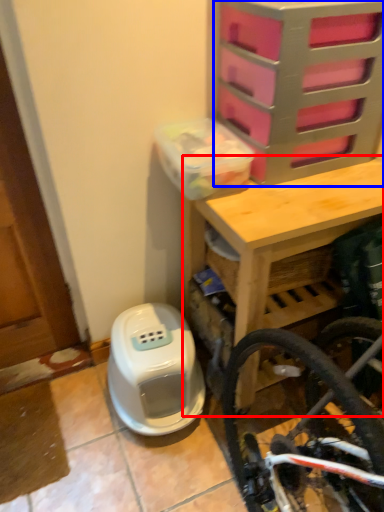
Question: Which object is closer to the camera taking this photo, table (highlighted by a red box) or drawer (highlighted by a blue box)?

Choices:
 (A) table
 (B) drawer

Answer: (B)